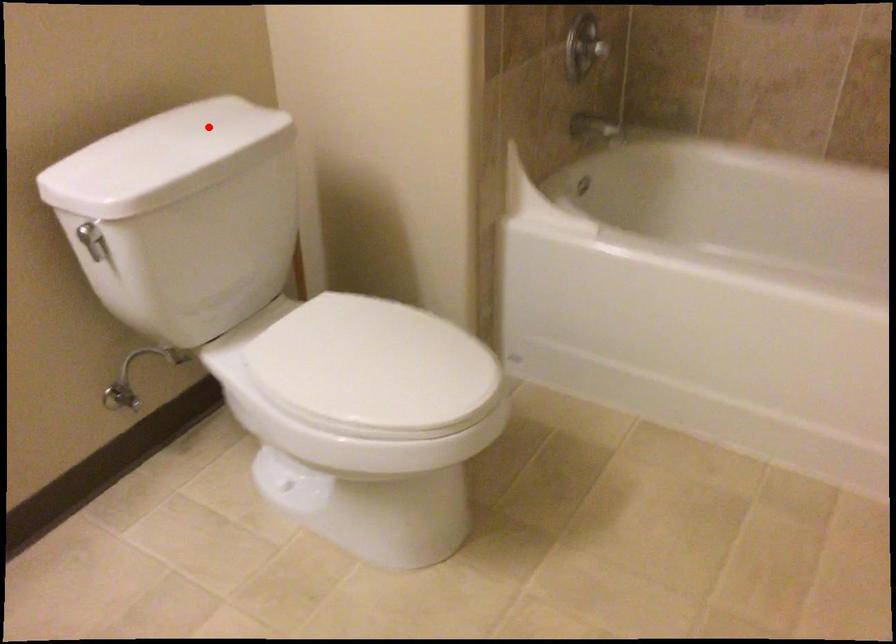
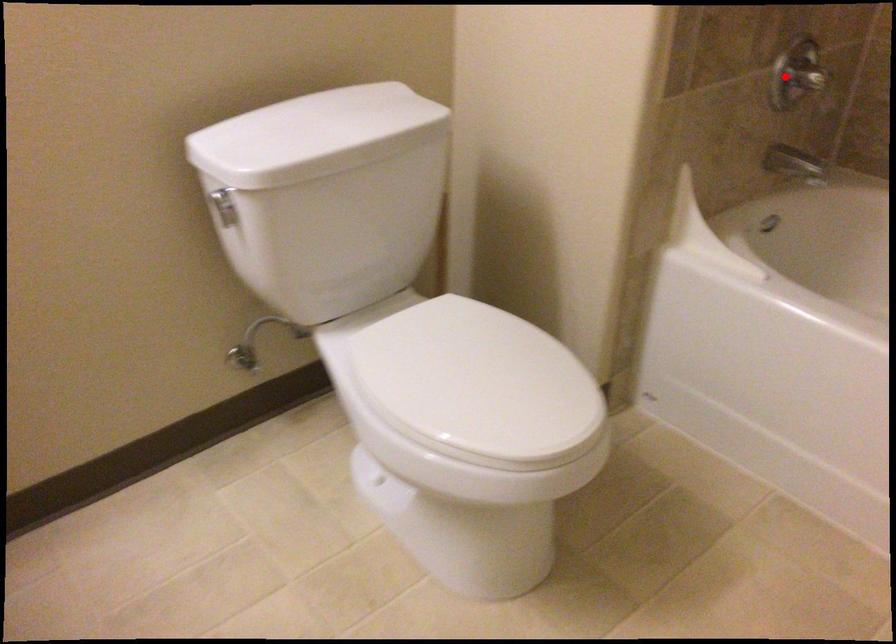
I am providing you with two images of the same scene from different viewpoints. A red point is marked on the first image and another point is marked on the second image. Is the marked point in image1 the same physical position as the marked point in image2?

No